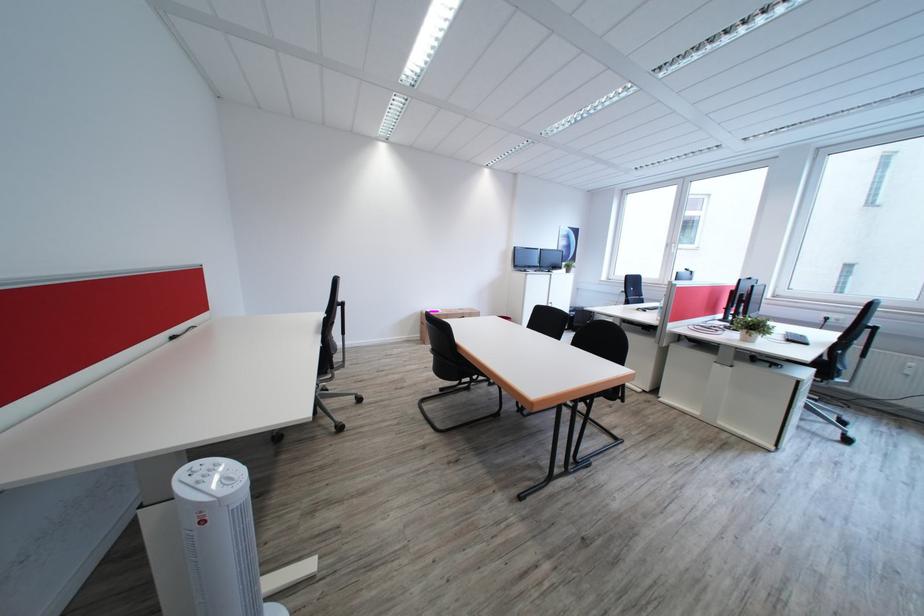
Where is `black computer mouse`? This screenshot has height=616, width=924. black computer mouse is located at coordinates (796, 338).